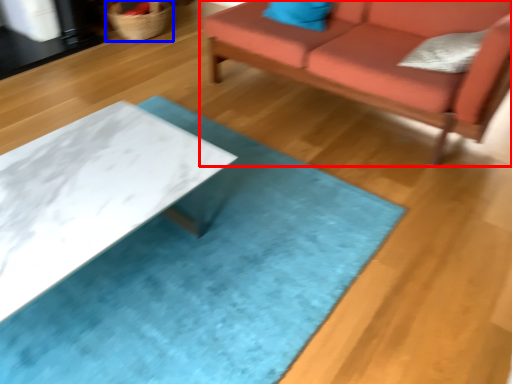
Question: Which point is further to the camera, studio couch (highlighted by a red box) or basket (highlighted by a blue box)?

Choices:
 (A) studio couch
 (B) basket

Answer: (B)